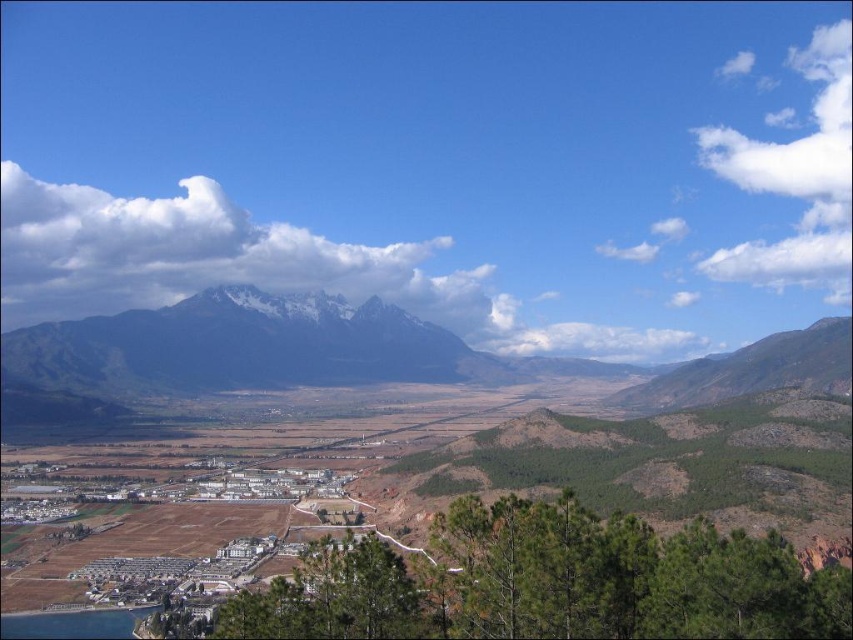
Question: Can you confirm if white fluffy cloud at upper left is positioned below snowy granite mountain range at center?

Choices:
 (A) yes
 (B) no

Answer: (B)

Question: Can you confirm if white fluffy cloud at upper left is positioned below snowy granite mountain range at center?

Choices:
 (A) no
 (B) yes

Answer: (A)

Question: Is the position of white fluffy cloud at upper left less distant than that of snowy granite mountain range at center?

Choices:
 (A) yes
 (B) no

Answer: (B)

Question: Which point is farther from the camera taking this photo?

Choices:
 (A) (154, 388)
 (B) (183, 259)

Answer: (B)

Question: Which object is closer to the camera taking this photo?

Choices:
 (A) white fluffy cloud at upper left
 (B) snowy granite mountain range at center

Answer: (B)